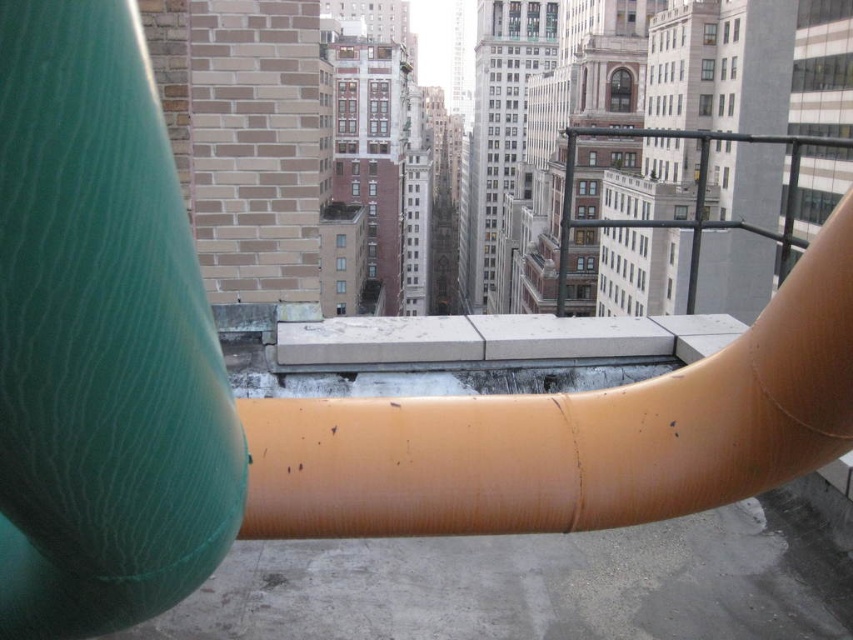
Question: Can you confirm if green rubber water pipe at left is bigger than orange rubber pipe at center?

Choices:
 (A) yes
 (B) no

Answer: (B)

Question: Is green rubber water pipe at left smaller than black metal rail at upper right?

Choices:
 (A) no
 (B) yes

Answer: (B)

Question: Which of these objects is positioned farthest from the green rubber water pipe at left?

Choices:
 (A) black metal rail at upper right
 (B) orange rubber pipe at center

Answer: (A)

Question: Is green rubber water pipe at left wider than orange rubber pipe at center?

Choices:
 (A) yes
 (B) no

Answer: (B)

Question: Which point appears closest to the camera in this image?

Choices:
 (A) (51, 412)
 (B) (577, 472)
 (C) (697, 230)

Answer: (A)

Question: Estimate the real-world distances between objects in this image. Which object is closer to the green rubber water pipe at left?

Choices:
 (A) black metal rail at upper right
 (B) orange rubber pipe at center

Answer: (B)